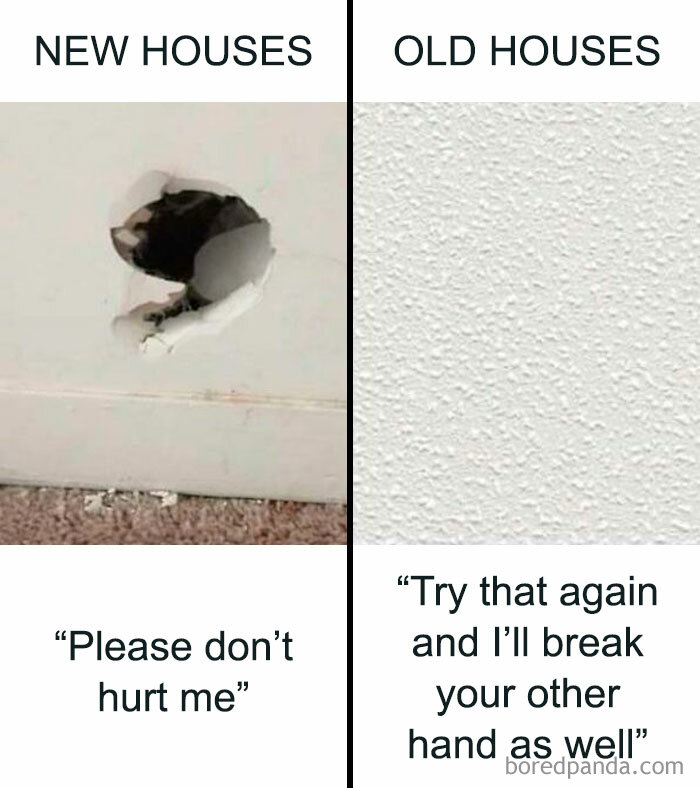
What are the coordinates of `carpet` in the screenshot? It's located at (293, 515).